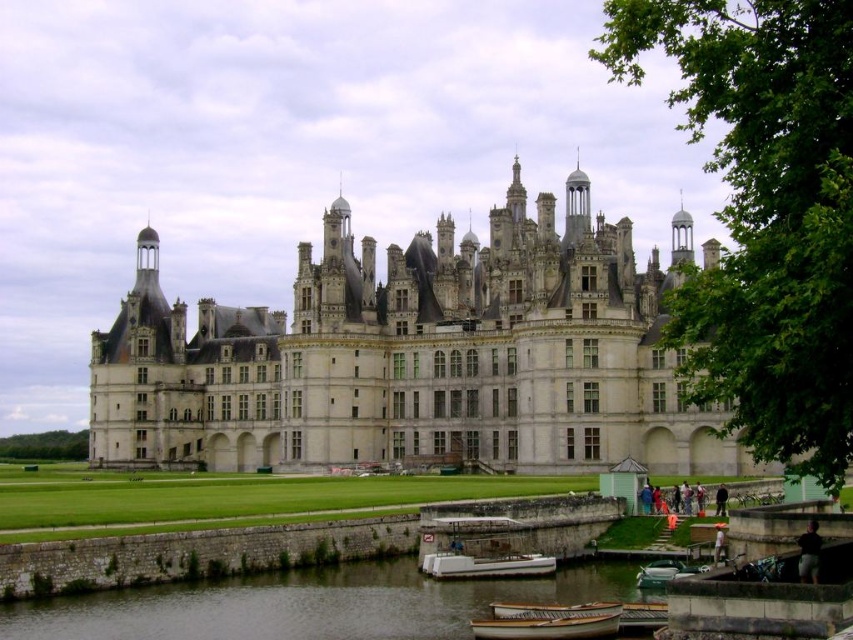
Question: Which point appears farthest from the camera in this image?

Choices:
 (A) (622, 584)
 (B) (645, 564)

Answer: (B)

Question: Can you confirm if green stone river at lower center is bigger than white plastic boat at lower center?

Choices:
 (A) no
 (B) yes

Answer: (B)

Question: Which point is farther to the camera?

Choices:
 (A) green polished wood boat at lower center
 (B) wooden boat at lower center
 (C) white plastic boat at lower center
 (D) green stone river at lower center

Answer: (C)

Question: Is the position of white plastic boat at lower center more distant than that of green polished wood boat at lower center?

Choices:
 (A) no
 (B) yes

Answer: (B)

Question: Is wooden boat at lower center further to the viewer compared to white plastic boat at lower center?

Choices:
 (A) no
 (B) yes

Answer: (A)

Question: Based on their relative distances, which object is nearer to the green polished wood boat at lower center?

Choices:
 (A) green stone river at lower center
 (B) white stone castle at center
 (C) wooden boat at lower center
 (D) white plastic boat at lower center

Answer: (D)